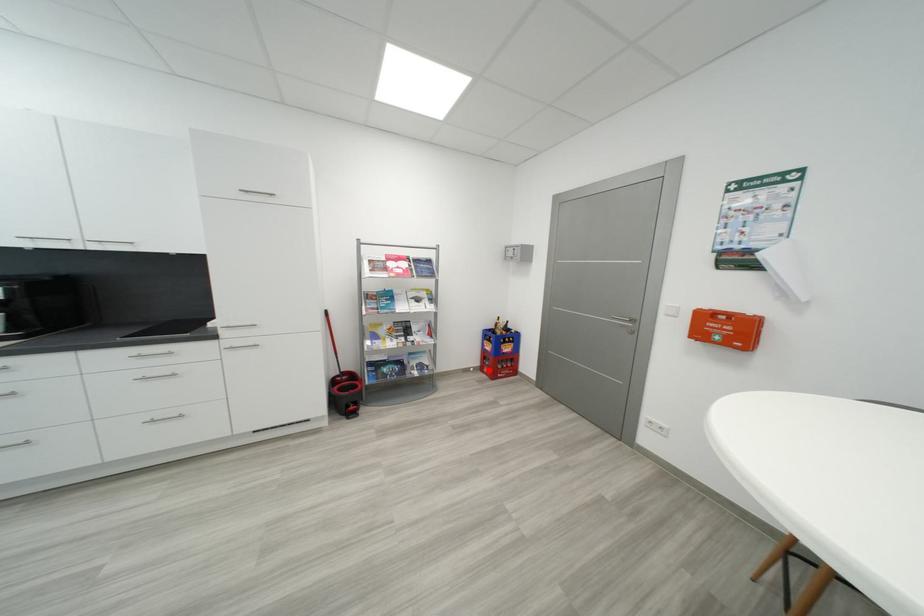
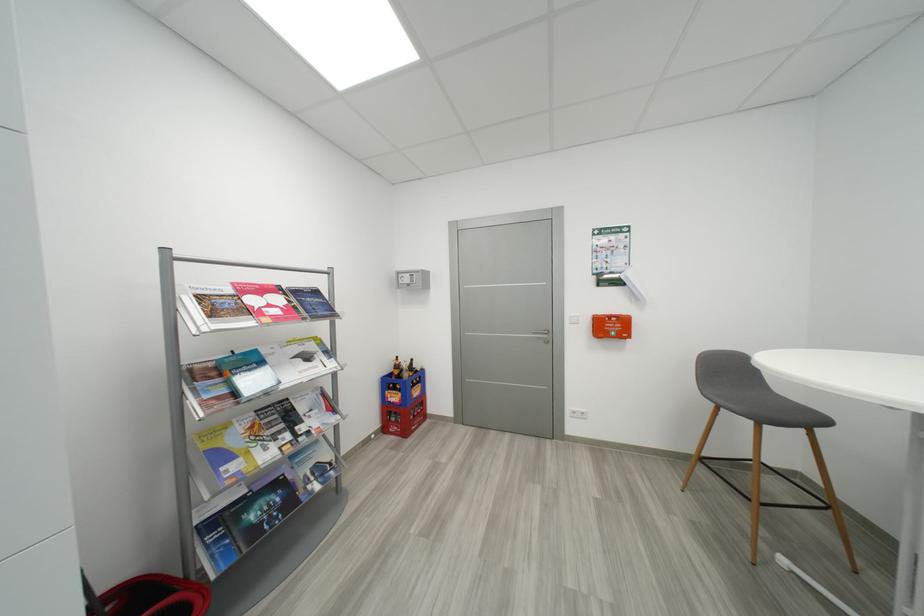
The point at the highlighted location is marked in the first image. Where is the corresponding point in the second image?

(392, 431)